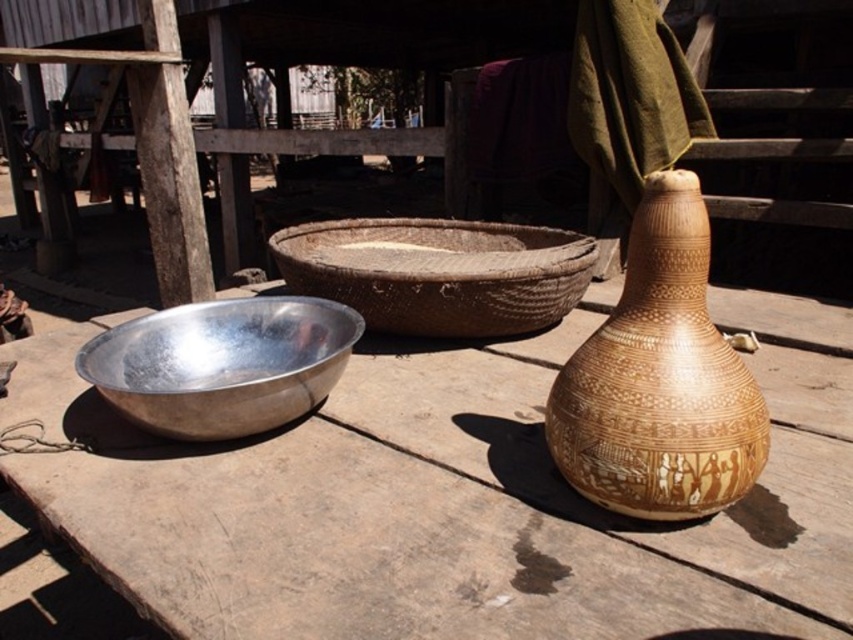
Question: Is brown textured vase at right to the left of silver metallic bowl at left from the viewer's perspective?

Choices:
 (A) yes
 (B) no

Answer: (B)

Question: Is the position of metallic wood table at center more distant than that of brown textured vase at right?

Choices:
 (A) no
 (B) yes

Answer: (A)

Question: Which object is positioned farthest from the brown textured vase at right?

Choices:
 (A) woven brown basket at center
 (B) silver metallic bowl at left

Answer: (A)

Question: Which point appears farthest from the camera in this image?

Choices:
 (A) (555, 435)
 (B) (148, 364)

Answer: (B)

Question: Which point is closer to the camera taking this photo?

Choices:
 (A) (283, 241)
 (B) (567, 636)

Answer: (B)

Question: Is metallic wood table at center to the right of silver metallic bowl at left from the viewer's perspective?

Choices:
 (A) no
 (B) yes

Answer: (B)